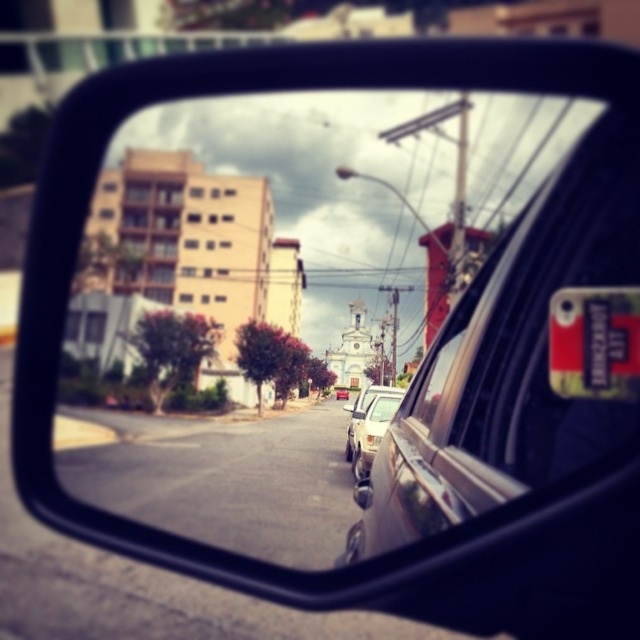
How distant is white matte car at center from white plastic license plate at center?

The distance of white matte car at center from white plastic license plate at center is 26.01 inches.

Does white matte car at center have a greater height compared to white plastic license plate at center?

Yes, white matte car at center is taller than white plastic license plate at center.

Which is in front, point (356, 442) or point (371, 442)?

Point (371, 442) is more forward.

Where is `white matte car at center`? The image size is (640, 640). white matte car at center is located at coordinates (369, 428).